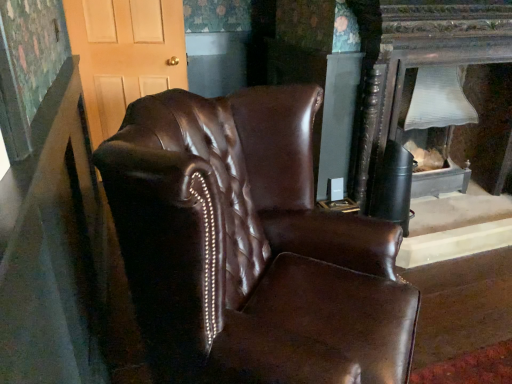
Question: Is shiny brown leather armchair at center in front of or behind matte wood door at upper left in the image?

Choices:
 (A) behind
 (B) front

Answer: (B)

Question: Which is correct: shiny brown leather armchair at center is inside matte wood door at upper left, or outside of it?

Choices:
 (A) outside
 (B) inside

Answer: (A)

Question: Which of these objects is positioned farthest from the shiny brown leather armchair at center?

Choices:
 (A) matte wood door at upper left
 (B) matte white lampshade at right

Answer: (A)

Question: Estimate the real-world distances between objects in this image. Which object is farther from the shiny brown leather armchair at center?

Choices:
 (A) matte wood door at upper left
 (B) matte white lampshade at right

Answer: (A)